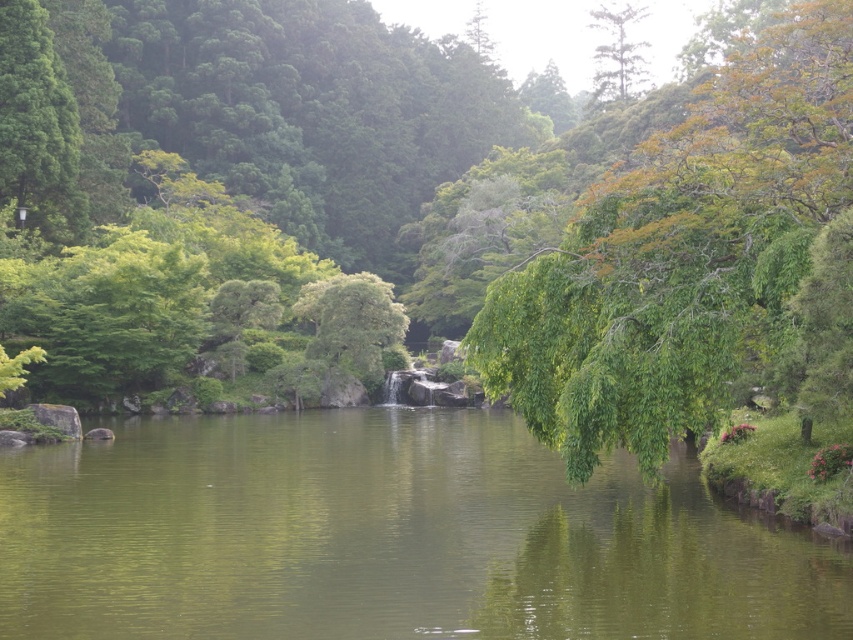
You are standing at the edge of the lake and see two points in the image. Which point, point (299,474) or point (497,312), is closer to you?

Point (299,474) is closer to you because it is further to the viewer than point (497,312).

You are standing at the edge of the lake and want to take a photo of the green leafy tree at upper center without the green smooth water at center blocking the view. Is this possible?

The green smooth water at center is in front of the green leafy tree at upper center, so it would block the view. To take a photo of the green leafy tree at upper center without the water blocking it, you would need to move to a position where the water is not between you and the tree.

You are standing on the lakeshore and see the green smooth water at center and the green leafy tree at right. Which object is closer to the water surface?

The green smooth water at center is closer to the water surface as it is located at the center of the lake, while the green leafy tree at right is positioned on the shore above the water.